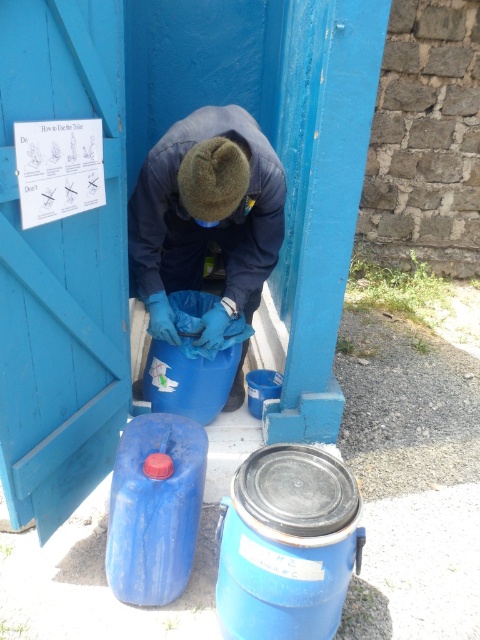
You are a maintenance worker needing to reach both the blue matte gloves at center and the blue plastic barrel at lower left. If your arm can extend 60 centimeters, can you grab both items without moving your position?

The distance between the blue matte gloves at center and the blue plastic barrel at lower left is 66.66 centimeters. Since your arm can only extend 60 centimeters, you cannot reach both items simultaneously without moving your position.

You are a worker who needs to place a new tool on the ground. The blue matte gloves at center and the blue plastic barrel at lower left are already there. Which object should you place the tool closer to if you want it to be more visible to someone approaching from the front?

The blue matte gloves at center are much taller than the blue plastic barrel at lower left, so placing the tool near the blue matte gloves at center would make it more visible to someone approaching from the front.

You are standing at the blue door and want to walk to the point marked as point (187, 509). There is an obstacle at point (180, 168). Will you need to go around it?

Since point (180, 168) is behind point (187, 509), you will not encounter the obstacle at point (180, 168) while walking to point (187, 509). Therefore, you do not need to go around it.